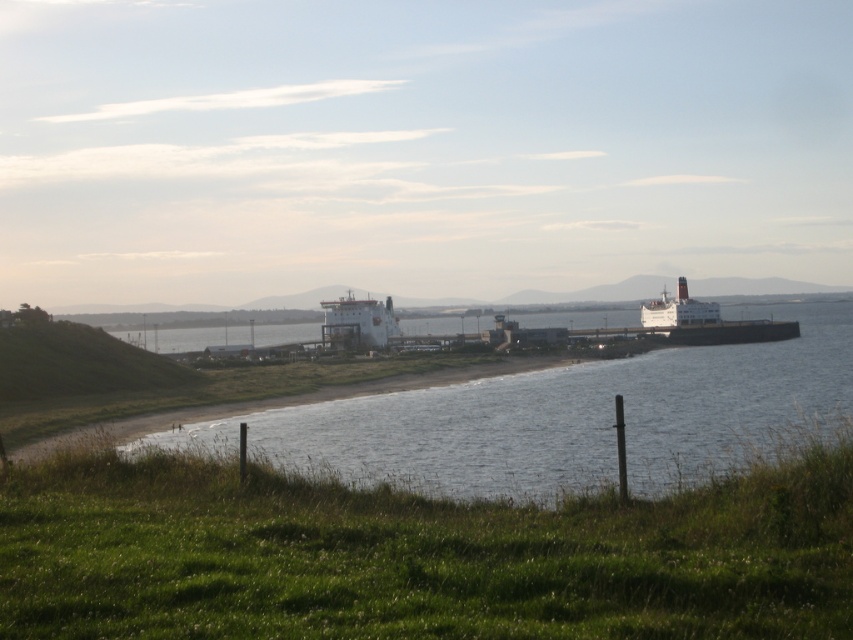
Does green grassy at lower left have a larger size compared to white matte ferry at upper right?

Actually, green grassy at lower left might be smaller than white matte ferry at upper right.

Is point (701, 605) farther from viewer compared to point (643, 304)?

No, (701, 605) is in front of (643, 304).

Identify the location of green grassy at lower left. The image size is (853, 640). (416, 554).

Can you confirm if green grassy at lower left is smaller than white matte ship at center?

Correct, green grassy at lower left occupies less space than white matte ship at center.

Who is positioned more to the right, green grassy at lower left or white matte ship at center?

green grassy at lower left

Between point (590, 548) and point (334, 314), which one is positioned in front?

Point (590, 548) is in front.

Locate an element on the screen. The height and width of the screenshot is (640, 853). green grassy at lower left is located at coordinates (416, 554).

Does point (650, 435) come closer to viewer compared to point (350, 330)?

Yes, it is in front of point (350, 330).

Which is below, clear water at center or white matte ship at center?

clear water at center is below.

Does point (158, 432) come closer to viewer compared to point (387, 310)?

Yes.

Where is `clear water at center`? clear water at center is located at coordinates (566, 419).